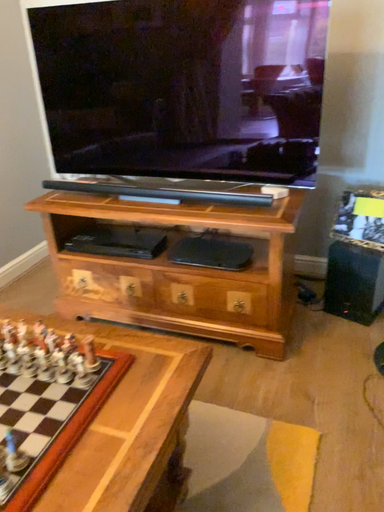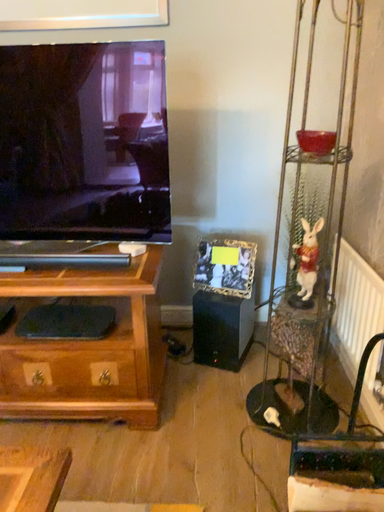
Question: Which way did the camera rotate in the video?

Choices:
 (A) rotated right
 (B) rotated left

Answer: (A)